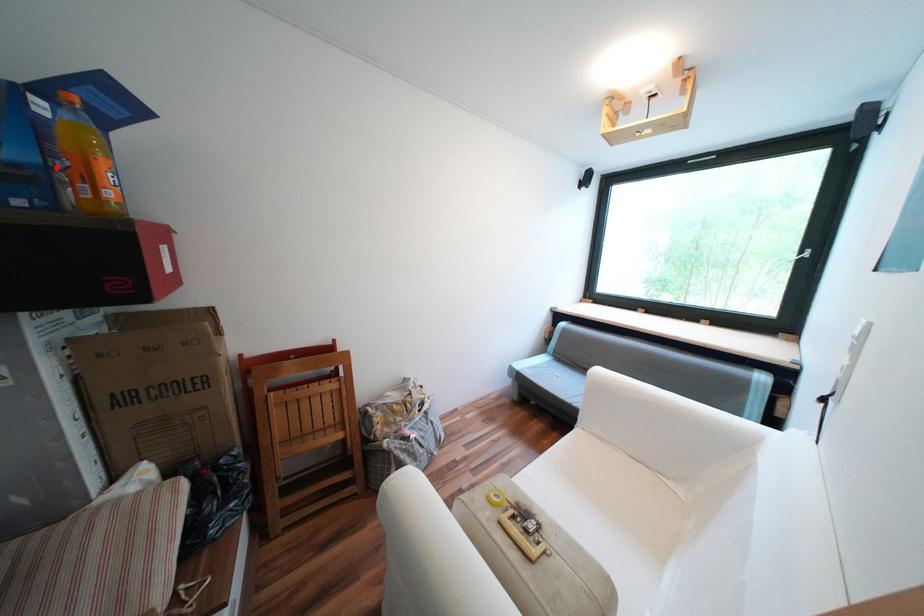
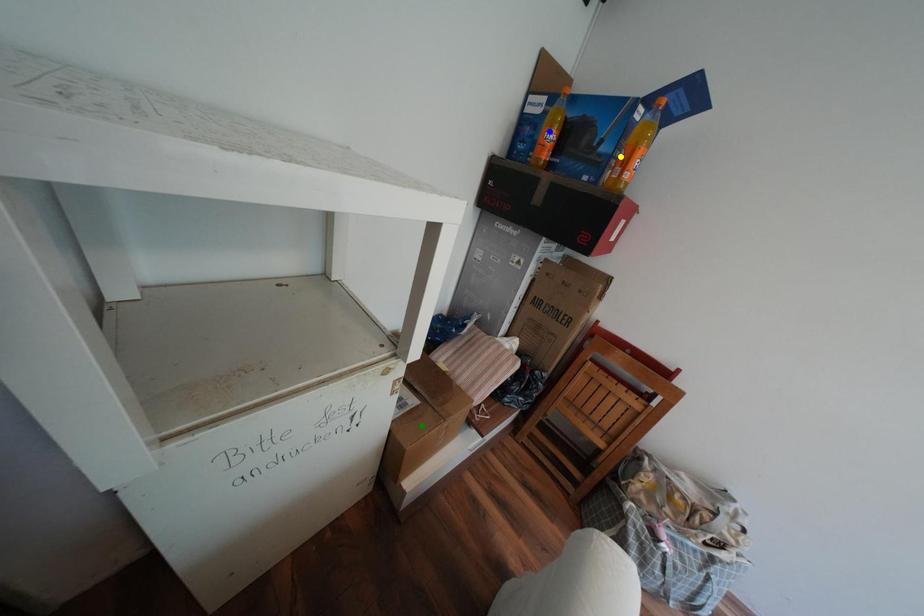
Question: I am providing you with two images of the same scene from different viewpoints. A red point is marked on the first image. You are given multiple points on the second image. Which mark in image 2 goes with the point in image 1?

Choices:
 (A) yellow point
 (B) green point
 (C) blue point

Answer: (A)